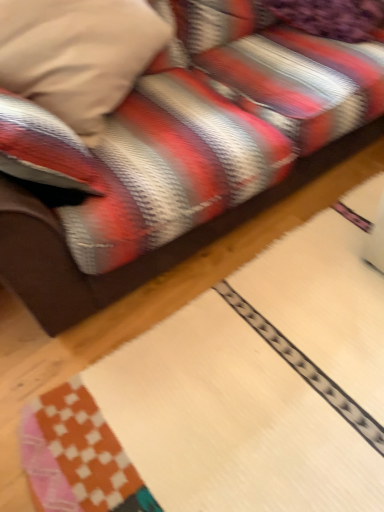
Question: In terms of height, does velvet purple pillow at upper right, which is the second pillow from left to right, look taller or shorter compared to velvety beige pillow at upper left, which appears as the second pillow when viewed from the right?

Choices:
 (A) tall
 (B) short

Answer: (B)

Question: In the image, is velvet purple pillow at upper right, which is the second pillow from left to right, positioned in front of or behind velvety beige pillow at upper left, which appears as the second pillow when viewed from the right?

Choices:
 (A) front
 (B) behind

Answer: (B)

Question: From the image's perspective, is velvet purple pillow at upper right, which is the second pillow from left to right, positioned above or below velvety beige pillow at upper left, which appears as the second pillow when viewed from the right?

Choices:
 (A) below
 (B) above

Answer: (B)

Question: Which is correct: velvety beige pillow at upper left, which appears as the second pillow when viewed from the right, is inside velvet purple pillow at upper right, which is the second pillow from left to right, or outside of it?

Choices:
 (A) outside
 (B) inside

Answer: (A)

Question: Is point (41, 2) closer or farther from the camera than point (326, 10)?

Choices:
 (A) closer
 (B) farther

Answer: (A)

Question: Considering their positions, is velvety beige pillow at upper left, which appears as the second pillow when viewed from the right, located in front of or behind velvet purple pillow at upper right, positioned as the first pillow in right-to-left order?

Choices:
 (A) front
 (B) behind

Answer: (A)

Question: From their relative heights in the image, would you say velvety beige pillow at upper left, which appears as the second pillow when viewed from the right, is taller or shorter than velvet purple pillow at upper right, positioned as the first pillow in right-to-left order?

Choices:
 (A) tall
 (B) short

Answer: (A)